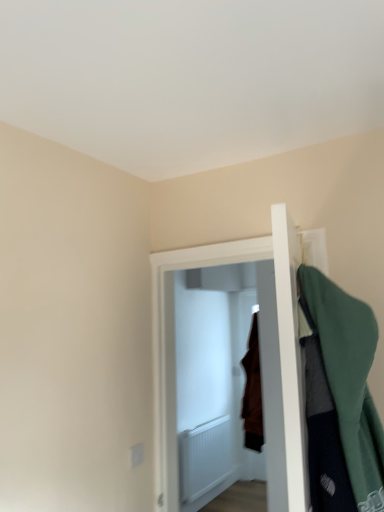
Question: Is white wooden door at center completely or partially inside green fabric coat at right?

Choices:
 (A) no
 (B) yes

Answer: (A)

Question: From the image's perspective, is green fabric coat at right below white wooden door at center?

Choices:
 (A) yes
 (B) no

Answer: (B)

Question: Can you confirm if green fabric coat at right is shorter than white wooden door at center?

Choices:
 (A) no
 (B) yes

Answer: (B)

Question: From a real-world perspective, is green fabric coat at right on white wooden door at center?

Choices:
 (A) no
 (B) yes

Answer: (B)

Question: Considering the relative sizes of green fabric coat at right and white wooden door at center in the image provided, is green fabric coat at right wider than white wooden door at center?

Choices:
 (A) no
 (B) yes

Answer: (A)

Question: Is green fabric coat at right in contact with white wooden door at center?

Choices:
 (A) no
 (B) yes

Answer: (A)

Question: From the image's perspective, is white wooden door at center under green fabric coat at right?

Choices:
 (A) no
 (B) yes

Answer: (B)

Question: Is white wooden door at center aimed at green fabric coat at right?

Choices:
 (A) no
 (B) yes

Answer: (A)

Question: Is the position of white wooden door at center more distant than that of green fabric coat at right?

Choices:
 (A) no
 (B) yes

Answer: (B)

Question: Considering the relative sizes of white wooden door at center and green fabric coat at right in the image provided, is white wooden door at center shorter than green fabric coat at right?

Choices:
 (A) no
 (B) yes

Answer: (A)

Question: Is white wooden door at center to the right of green fabric coat at right from the viewer's perspective?

Choices:
 (A) yes
 (B) no

Answer: (B)

Question: From the image's perspective, is white wooden door at center on green fabric coat at right?

Choices:
 (A) no
 (B) yes

Answer: (A)

Question: From the image's perspective, relative to green fabric coat at right, is white wooden door at center above or below?

Choices:
 (A) above
 (B) below

Answer: (B)